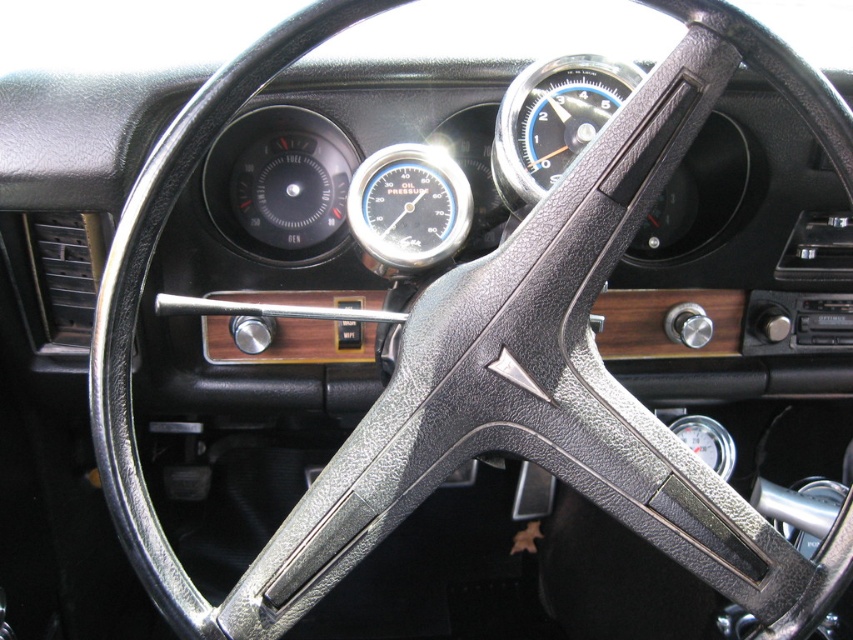
Question: Does blue leather speedometer at upper center appear under matte black gauge at center?

Choices:
 (A) no
 (B) yes

Answer: (A)

Question: Is blue leather speedometer at upper center smaller than matte black gauge at center?

Choices:
 (A) yes
 (B) no

Answer: (B)

Question: Which point is farther from the camera taking this photo?

Choices:
 (A) (410, 193)
 (B) (532, 88)

Answer: (A)

Question: Which of the following is the closest to the observer?

Choices:
 (A) (508, 152)
 (B) (432, 182)

Answer: (A)

Question: Does blue leather speedometer at upper center appear under matte black gauge at center?

Choices:
 (A) yes
 (B) no

Answer: (B)